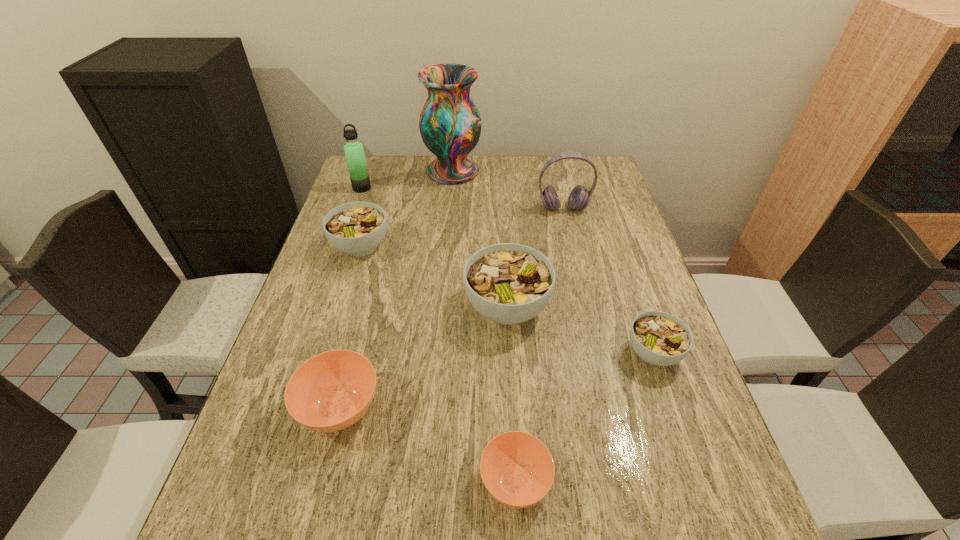
What are the coordinates of `the smallest white soup bowl` in the screenshot? It's located at (659, 338).

Where is `the shortest soup bowl`? The width and height of the screenshot is (960, 540). the shortest soup bowl is located at coordinates (517, 469).

The image size is (960, 540). Find the location of `the right peach soup bowl`. the right peach soup bowl is located at coordinates (517, 469).

The width and height of the screenshot is (960, 540). In order to click on free point located on the right of the vase in this screenshot , I will do `click(516, 171)`.

Identify the location of vacant space situated 0.400m on the right of the thermos bottle. The image size is (960, 540). (491, 188).

Find the location of a particular element. vacant region located 0.370m on the headband and ear cups of the sixth shortest object is located at coordinates (586, 304).

At what (x,y) coordinates should I click in order to perform the action: click on vacant space located on the front of the fourth tallest object. Please return your answer as a coordinate pair (x, y). This screenshot has height=540, width=960. Looking at the image, I should click on (515, 427).

Where is `free space located on the right of the leftmost white soup bowl`? This screenshot has height=540, width=960. free space located on the right of the leftmost white soup bowl is located at coordinates (478, 246).

Where is `vacant space located 0.300m on the back of the left peach soup bowl`? Image resolution: width=960 pixels, height=540 pixels. vacant space located 0.300m on the back of the left peach soup bowl is located at coordinates (373, 276).

The image size is (960, 540). What are the coordinates of `free space located 0.390m on the left of the rightmost white soup bowl` in the screenshot? It's located at (451, 353).